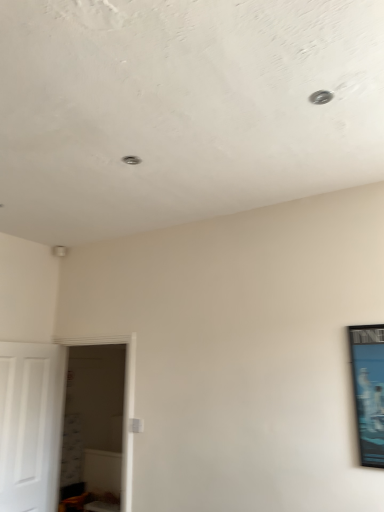
Question: Would you consider white glossy door at left to be distant from white matte door at left?

Choices:
 (A) yes
 (B) no

Answer: (B)

Question: Does white glossy door at left come in front of white matte door at left?

Choices:
 (A) no
 (B) yes

Answer: (A)

Question: Does white glossy door at left have a greater height compared to white matte door at left?

Choices:
 (A) yes
 (B) no

Answer: (A)

Question: Does white glossy door at left have a smaller size compared to white matte door at left?

Choices:
 (A) yes
 (B) no

Answer: (B)

Question: Is white glossy door at left positioned with its back to white matte door at left?

Choices:
 (A) no
 (B) yes

Answer: (B)

Question: From the image's perspective, is white glossy door at left over white matte door at left?

Choices:
 (A) no
 (B) yes

Answer: (A)

Question: Is metallic blue poster at right next to white glossy door at left and touching it?

Choices:
 (A) no
 (B) yes

Answer: (A)

Question: From a real-world perspective, does metallic blue poster at right sit lower than white glossy door at left?

Choices:
 (A) no
 (B) yes

Answer: (A)

Question: Is metallic blue poster at right aimed at white glossy door at left?

Choices:
 (A) yes
 (B) no

Answer: (B)

Question: Is metallic blue poster at right not within white glossy door at left?

Choices:
 (A) yes
 (B) no

Answer: (A)

Question: Does metallic blue poster at right have a lesser width compared to white glossy door at left?

Choices:
 (A) yes
 (B) no

Answer: (A)

Question: Does metallic blue poster at right contain white glossy door at left?

Choices:
 (A) no
 (B) yes

Answer: (A)

Question: Can you confirm if white glossy door at left is shorter than metallic blue poster at right?

Choices:
 (A) yes
 (B) no

Answer: (B)